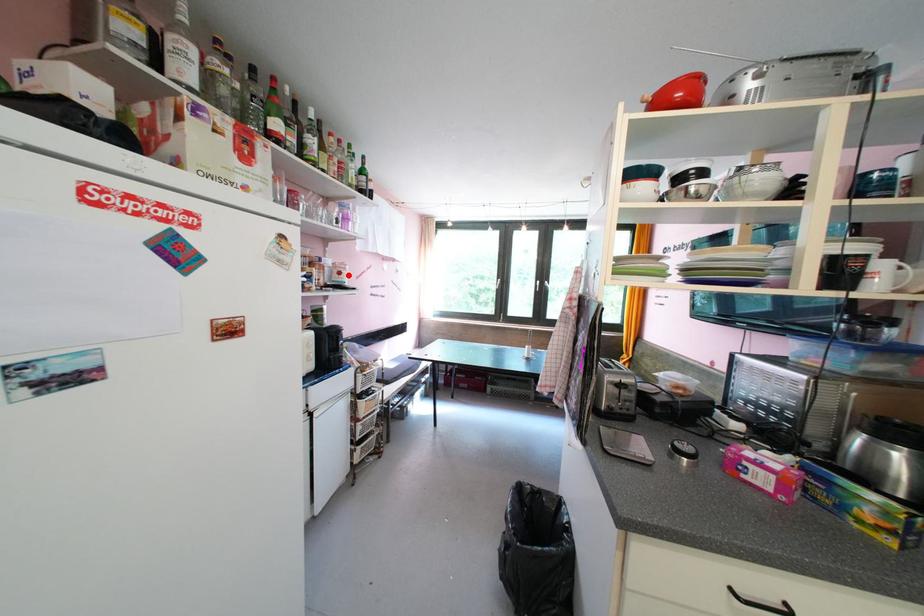
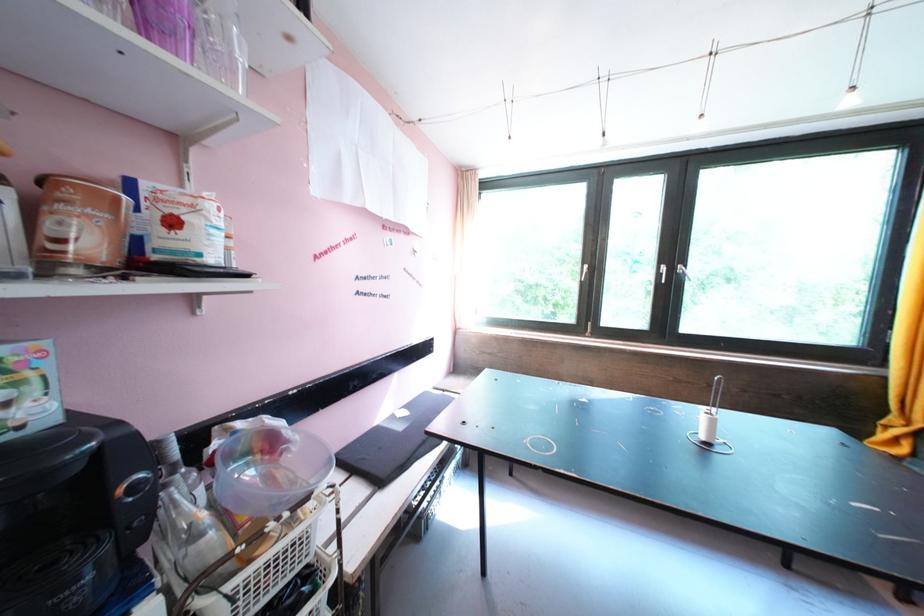
Find the pixel in the second image that matches the highlighted location in the first image.

(181, 225)